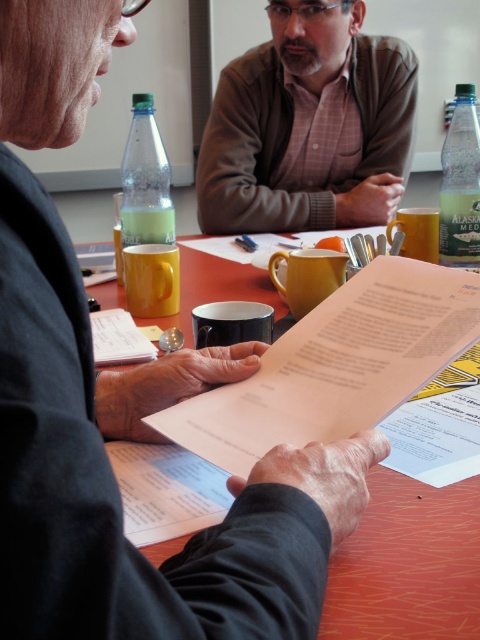
Consider the image. You are a guest at this meeting and need to place your yellow matte mug at upper center on the wooden table at center. Will the mug fit on the table without hanging over the edges?

The wooden table at center has a greater height compared to yellow matte mug at upper center, so the mug will fit on the table without hanging over the edges since the table is taller than the mug.

You are organizing a presentation and need to ensure that all materials fit on the table. Given the brown textured shirt at upper center and the white paper at center, which item occupies a greater horizontal space?

The brown textured shirt at upper center has a larger width than the white paper at center, so it occupies more horizontal space.